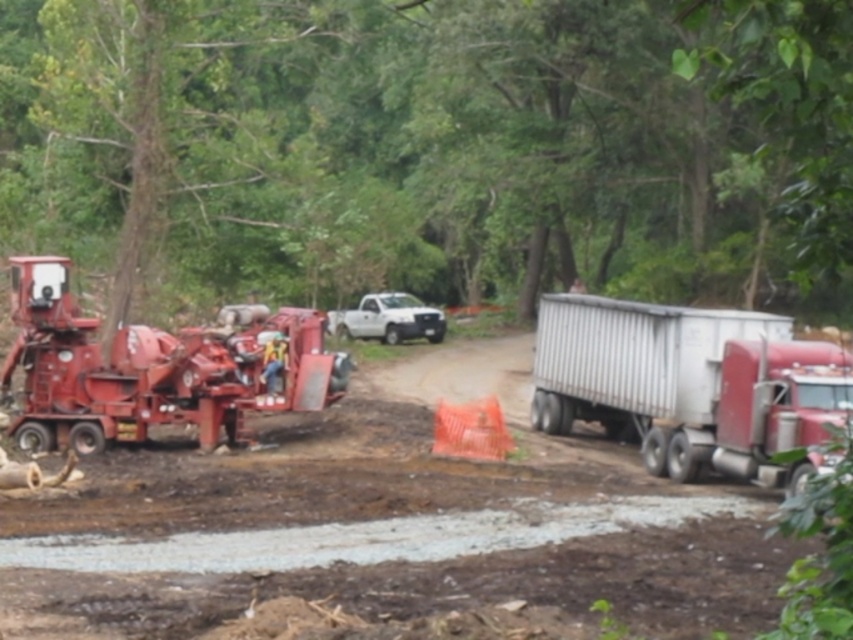
Does brushed metal truck at center have a greater width compared to white metallic trailer truck at right?

Yes.

Is brushed metal truck at center above white metallic trailer truck at right?

Correct, brushed metal truck at center is located above white metallic trailer truck at right.

Who is more distant from viewer, (160, 64) or (619, 369)?

The point (160, 64) is more distant.

This screenshot has height=640, width=853. What are the coordinates of `brushed metal truck at center` in the screenshot? It's located at (431, 148).

Is matte red construction equipment at left thinner than orange safety vest at center?

No.

Is point (113, 548) less distant than point (276, 360)?

That is True.

Is point (28, 298) positioned in front of point (271, 387)?

Yes, point (28, 298) is closer to viewer.

The width and height of the screenshot is (853, 640). Identify the location of matte red construction equipment at left. (363, 506).

Does white metallic trailer truck at right have a larger size compared to white matte truck at center?

Yes.

Which of these two, white metallic trailer truck at right or white matte truck at center, stands shorter?

white matte truck at center is shorter.

Does point (602, 314) come closer to viewer compared to point (413, 326)?

Yes.

Where is `white metallic trailer truck at right`? This screenshot has height=640, width=853. white metallic trailer truck at right is located at coordinates (688, 384).